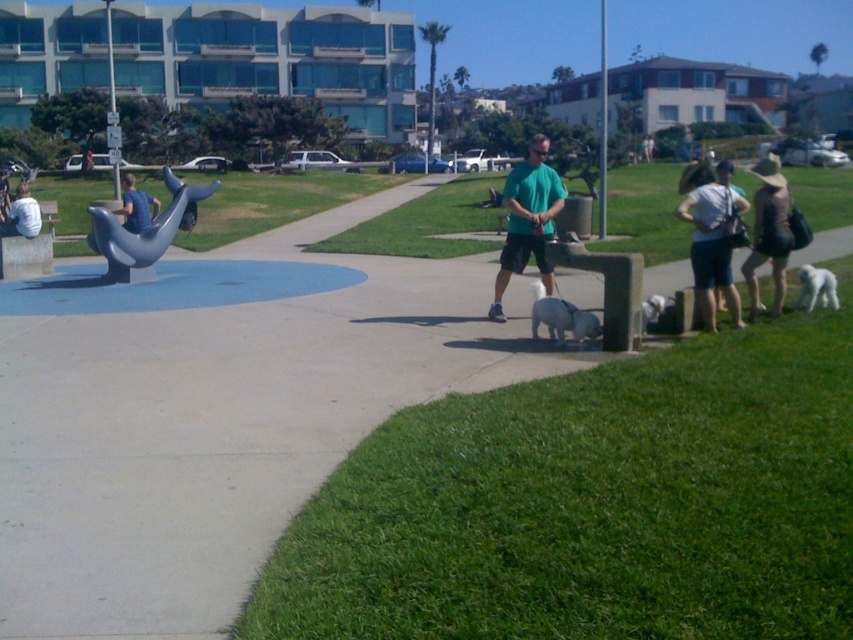
You are a photographer at the park and want to take a photo that includes both the white fluffy dog at lower right and the white shirt at left. Which object should you zoom in on to ensure both are in frame?

The white fluffy dog at lower right is smaller than the white shirt at left, so you should zoom in on the white shirt at left to ensure both are in frame.

You are a photographer trying to capture a group photo of the white fluffy dog at lower right and the white shirt at left. Since you want them to be the same size in the photo, which one should you move closer to the camera?

The white fluffy dog at lower right is smaller in width than the white shirt at left, so you should move the white shirt at left closer to the camera to make them appear the same size in the photo.